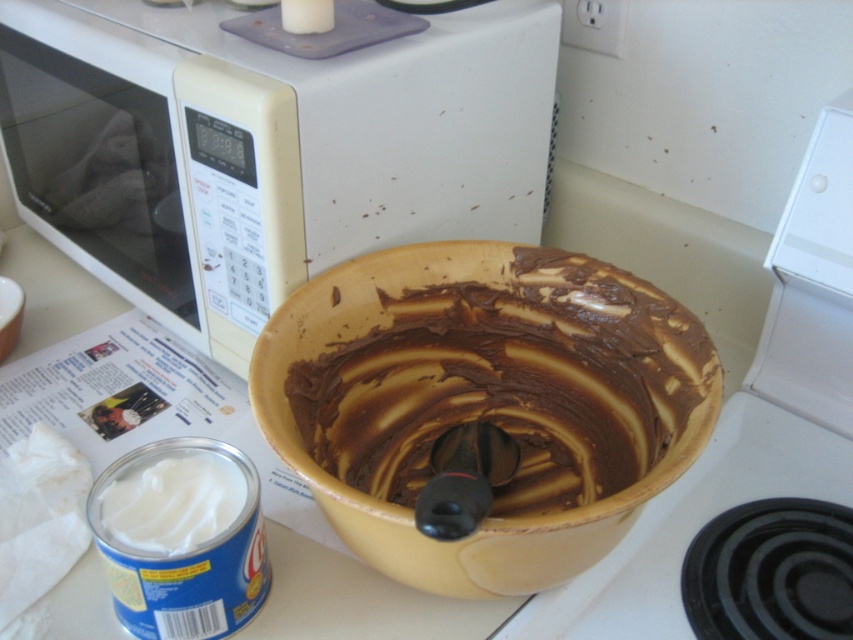
Question: Which point is farther from the camera taking this photo?

Choices:
 (A) (386, 484)
 (B) (137, 500)

Answer: (A)

Question: Is white plastic microwave at upper left positioned before yellow matte bowl at center?

Choices:
 (A) yes
 (B) no

Answer: (B)

Question: Is yellow matte bowl at center to the right of white creamy frosting at lower left from the viewer's perspective?

Choices:
 (A) yes
 (B) no

Answer: (A)

Question: Based on their relative distances, which object is farther from the white creamy frosting at lower left?

Choices:
 (A) yellow matte bowl at center
 (B) white plastic microwave at upper left

Answer: (B)

Question: Among these points, which one is nearest to the camera?

Choices:
 (A) (664, 477)
 (B) (497, 218)

Answer: (A)

Question: Can you confirm if white plastic microwave at upper left is wider than white creamy frosting at lower left?

Choices:
 (A) yes
 (B) no

Answer: (A)